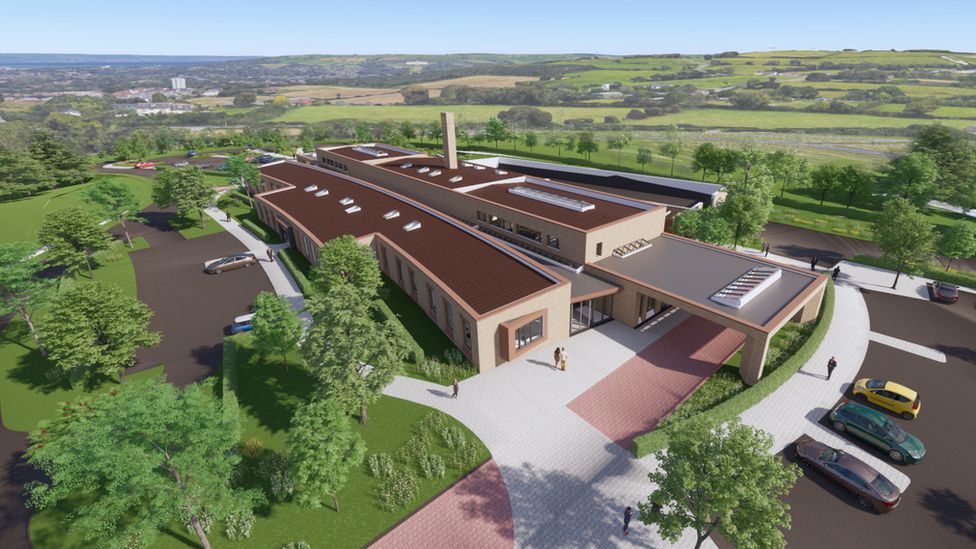
Where is `chimney`? chimney is located at coordinates (454, 150).